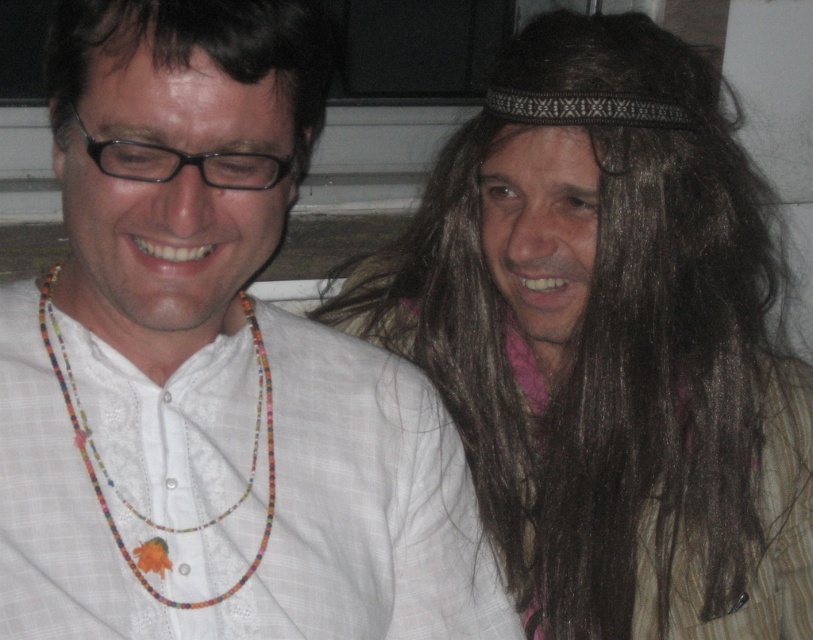
You are taking a photo of two people sitting near a window. You notice the brown hair at upper right and the dark brown hair at upper left in the frame. Which hair is positioned lower in the image?

The brown hair at upper right is located below the dark brown hair at upper left, so the brown hair at upper right is positioned lower in the image.

You are standing in the room and want to touch the brown hair at upper right. Considering your arm is 2.5 feet long, can you reach it without moving?

The brown hair at upper right is 4.05 feet away from you, which is farther than your arm length of 2.5 feet. Therefore, you cannot reach it without moving closer.

You are a photographer setting up for a portrait and need to ensure that the brown hair at upper right and the beaded necklace at left are clearly visible in the frame. Given that your camera has a minimum focus distance of 12 inches, will both subjects be in focus?

The distance between the brown hair at upper right and beaded necklace at left is 12.57 inches. Since this exceeds the camera minimum focus distance of 12 inches, both subjects will be in focus.